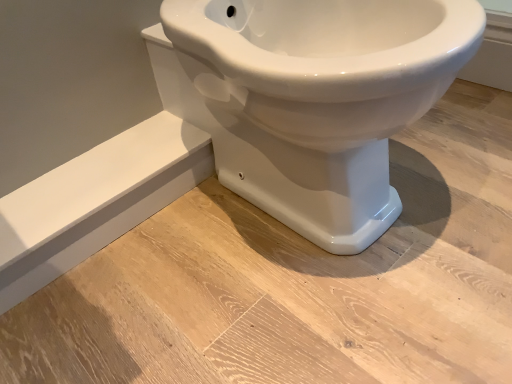
Find the location of a particular element. The height and width of the screenshot is (384, 512). vacant area to the right of white glossy toilet at center is located at coordinates (462, 150).